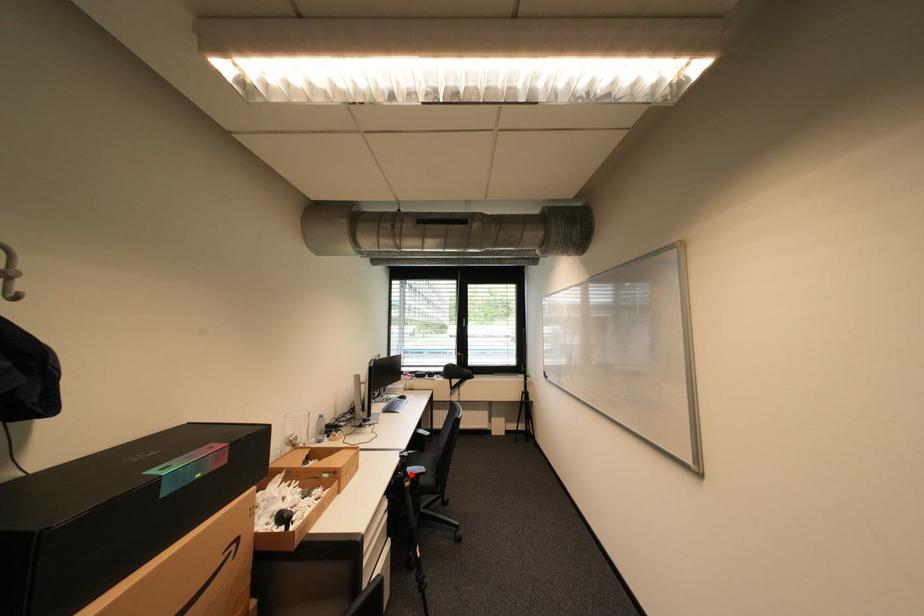
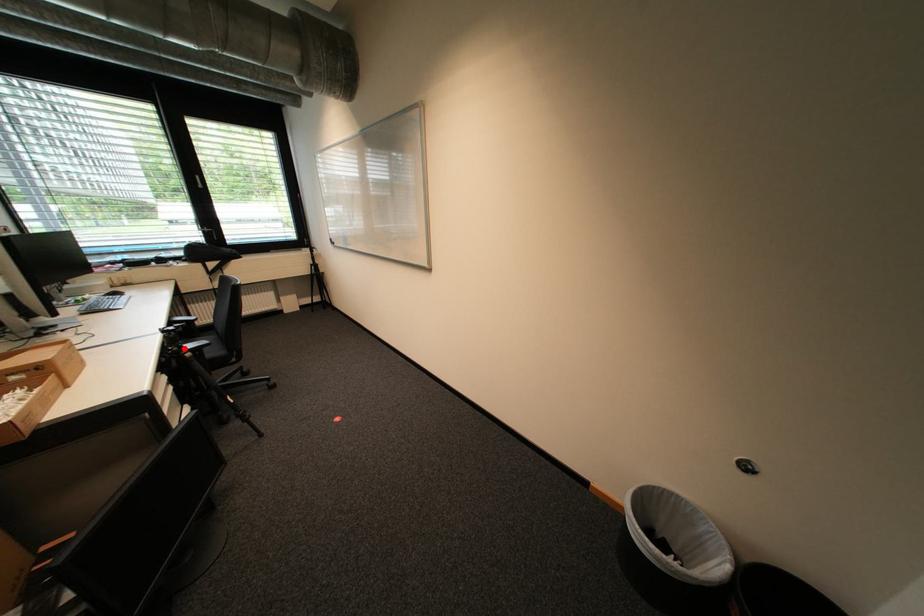
I am providing you with two images of the same scene from different viewpoints. A red point is marked on the first image and another point is marked on the second image. Is the red point in image1 aligned with the point shown in image2?

Yes